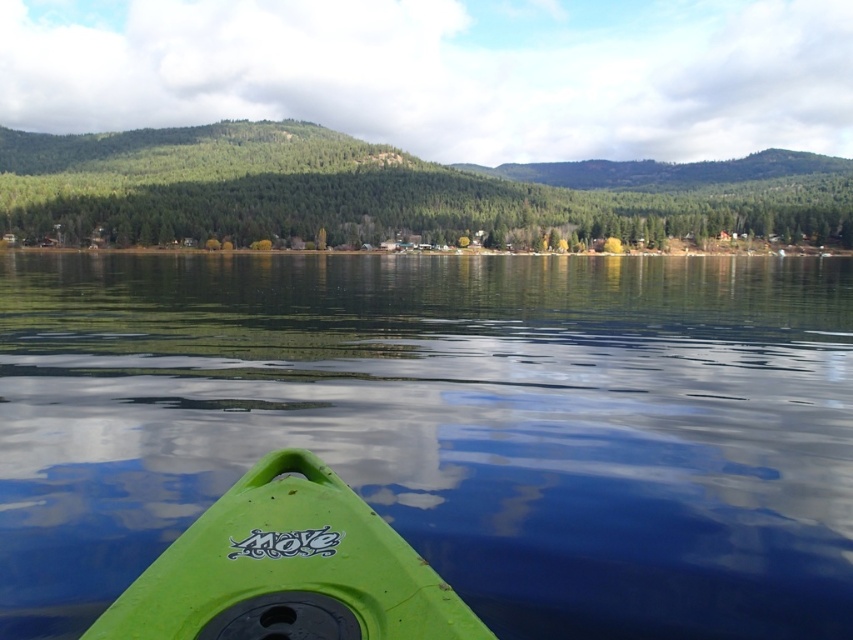
Does transparent water at center have a larger size compared to green matte kayak at lower center?

Correct, transparent water at center is larger in size than green matte kayak at lower center.

Between transparent water at center and green matte kayak at lower center, which one has less height?

green matte kayak at lower center is shorter.

Who is more forward, (331, 289) or (277, 600)?

Positioned in front is point (277, 600).

Find the location of a particular element. transparent water at center is located at coordinates (445, 428).

Does green forested mountain at upper center have a lesser width compared to green matte kayak at lower center?

In fact, green forested mountain at upper center might be wider than green matte kayak at lower center.

Is green forested mountain at upper center below green matte kayak at lower center?

Incorrect, green forested mountain at upper center is not positioned below green matte kayak at lower center.

Is point (817, 241) behind point (201, 589)?

That is True.

Where is `green forested mountain at upper center`? green forested mountain at upper center is located at coordinates (392, 192).

Is transparent water at center closer to the viewer compared to green forested mountain at upper center?

Yes.

Image resolution: width=853 pixels, height=640 pixels. I want to click on transparent water at center, so click(x=445, y=428).

Image resolution: width=853 pixels, height=640 pixels. I want to click on transparent water at center, so click(445, 428).